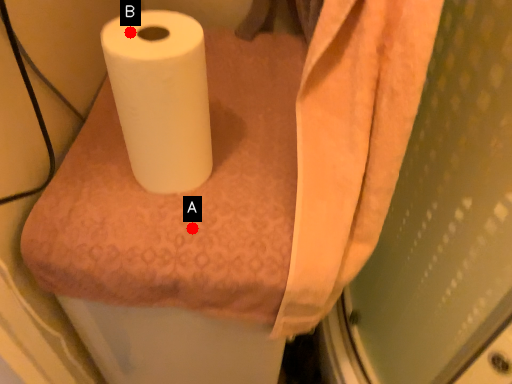
Question: Two points are circled on the image, labeled by A and B beside each circle. Among these points, which one is farthest from the camera?

Choices:
 (A) A is further
 (B) B is further

Answer: (A)